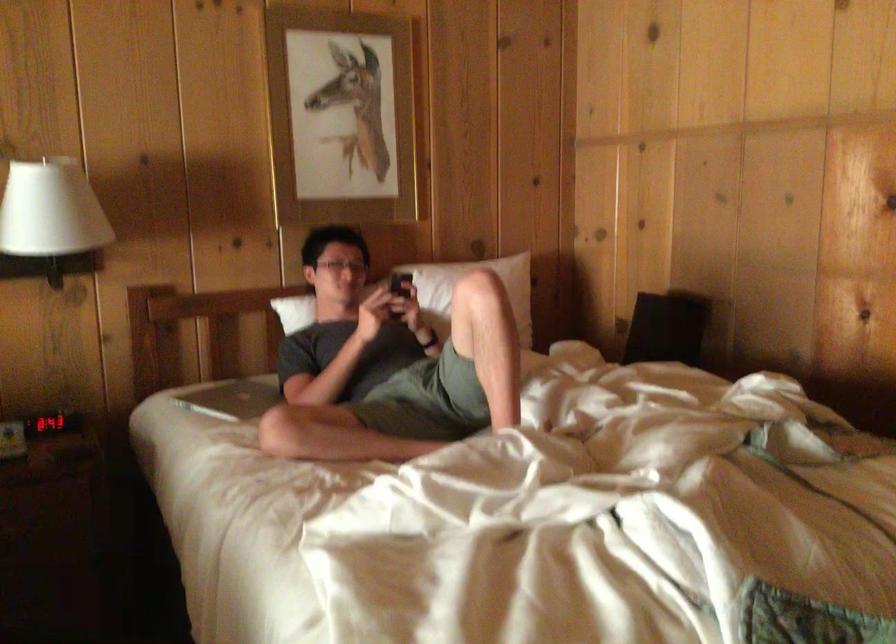
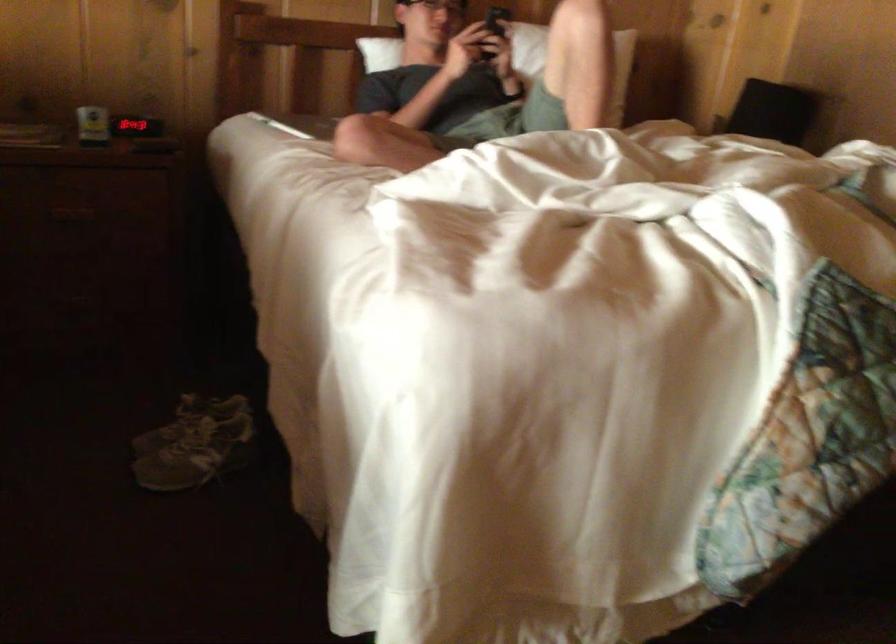
Question: The images are taken continuously from a first-person perspective. In which direction is your viewpoint rotating?

Choices:
 (A) Left
 (B) Right
 (C) Up
 (D) Down

Answer: (D)